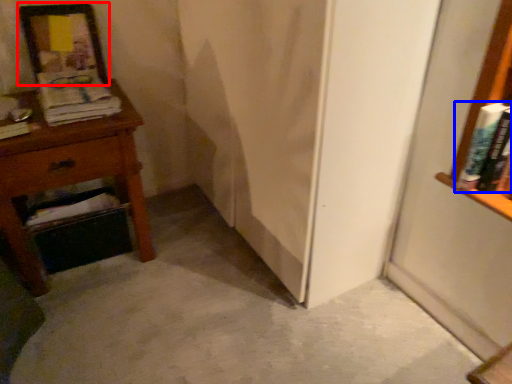
Question: Which point is further to the camera, picture frame (highlighted by a red box) or book (highlighted by a blue box)?

Choices:
 (A) picture frame
 (B) book

Answer: (A)